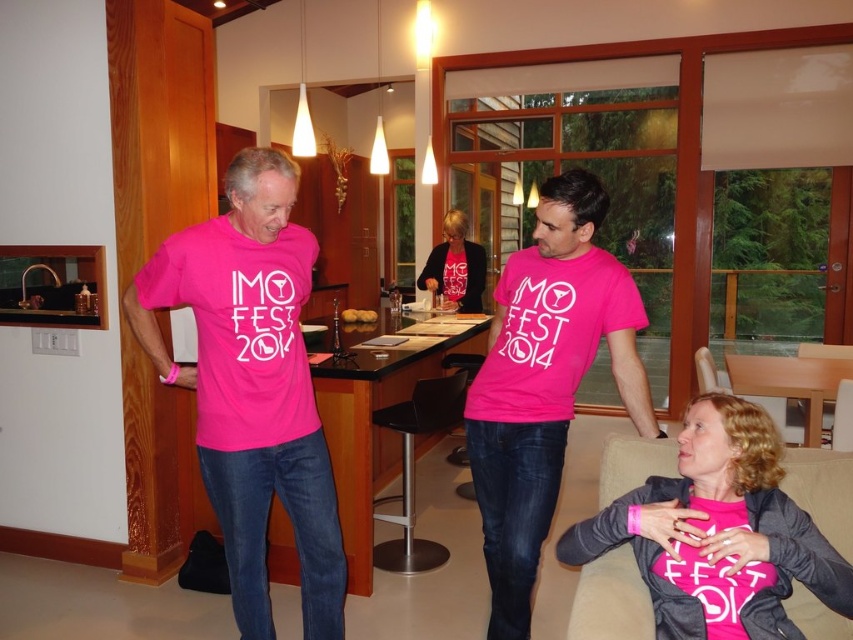
You are organizing a charity event and need to display two pink shirts. The pink matte shirt at center and the pink jersey at center must be hung on a rack. According to the image, which one should be placed lower on the rack?

The pink matte shirt at center should be placed lower on the rack since it is positioned under the pink jersey at center in the image.

You are organizing a charity event and need to display two pink shirts from the image. The pink matte shirt at center and the pink jersey at center must be placed on a vertical display rack. Which one should be placed lower on the rack to ensure both shirts are visible?

The pink matte shirt at center should be placed lower on the rack because it has a lesser height compared to the pink jersey at center, allowing both shirts to be visible without one blocking the other.